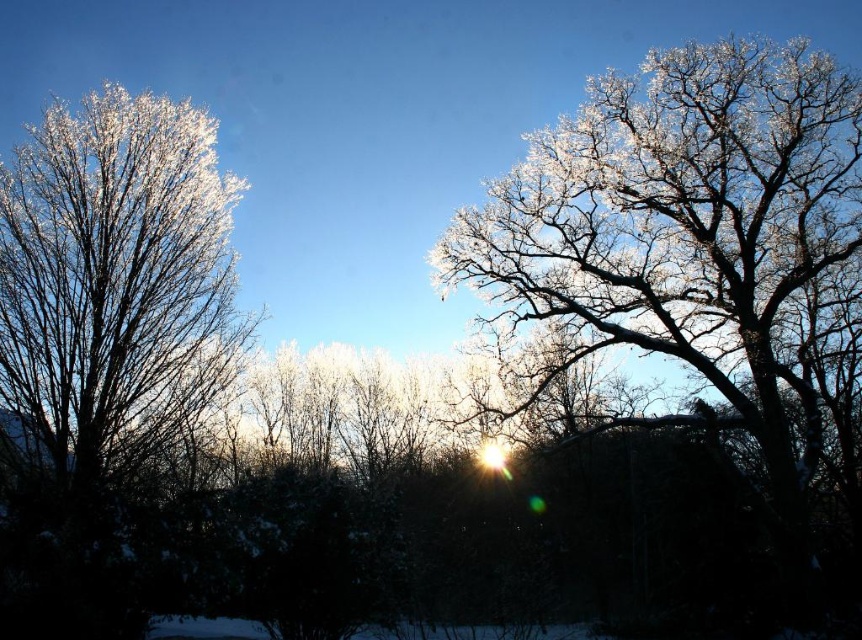
Is the position of frosted white tree at upper right less distant than that of frosty white branches at left?

No, it is not.

Which is behind, point (617, 220) or point (186, 100)?

Positioned behind is point (617, 220).

Where is `frosted white tree at upper right`? The width and height of the screenshot is (862, 640). frosted white tree at upper right is located at coordinates (686, 244).